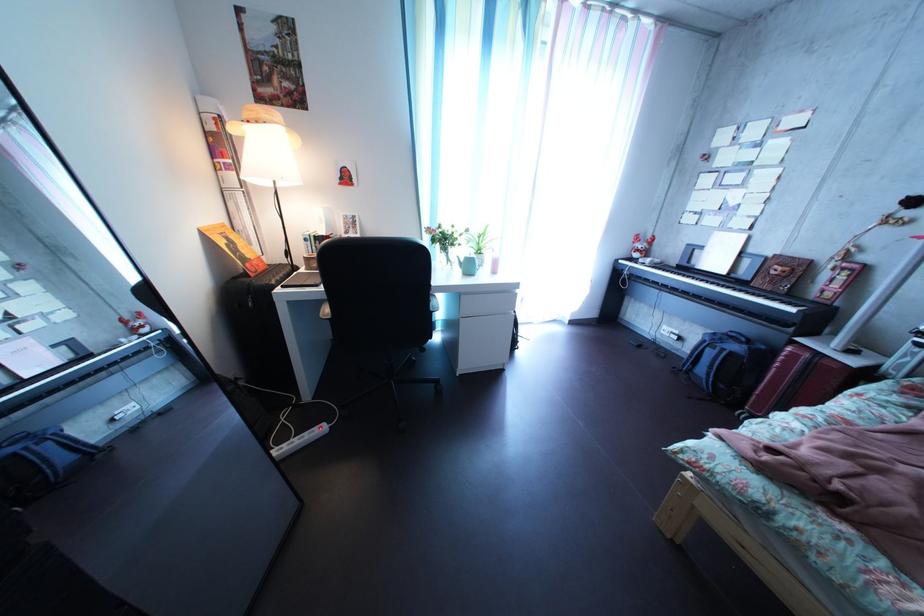
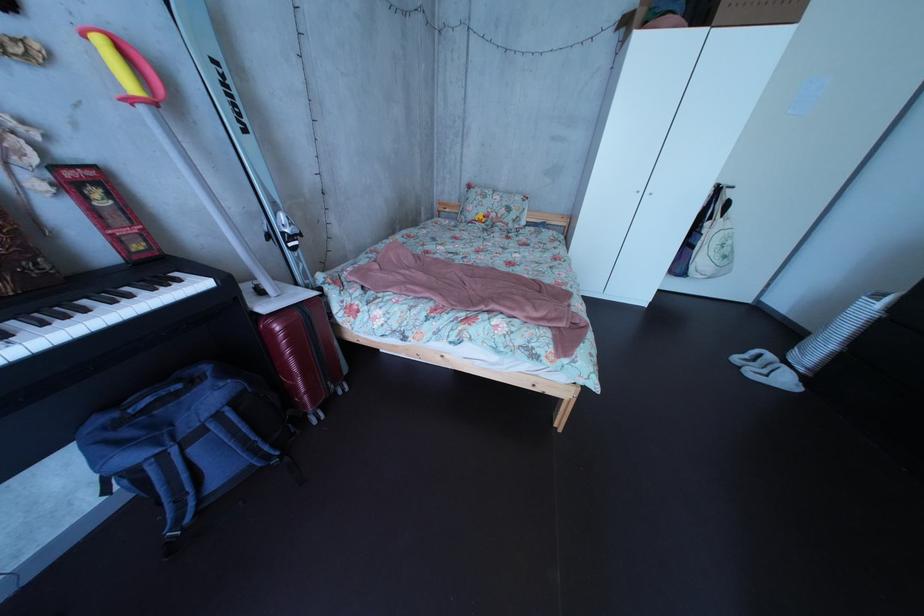
The point at (787, 308) is marked in the first image. Where is the corresponding point in the second image?

(128, 305)